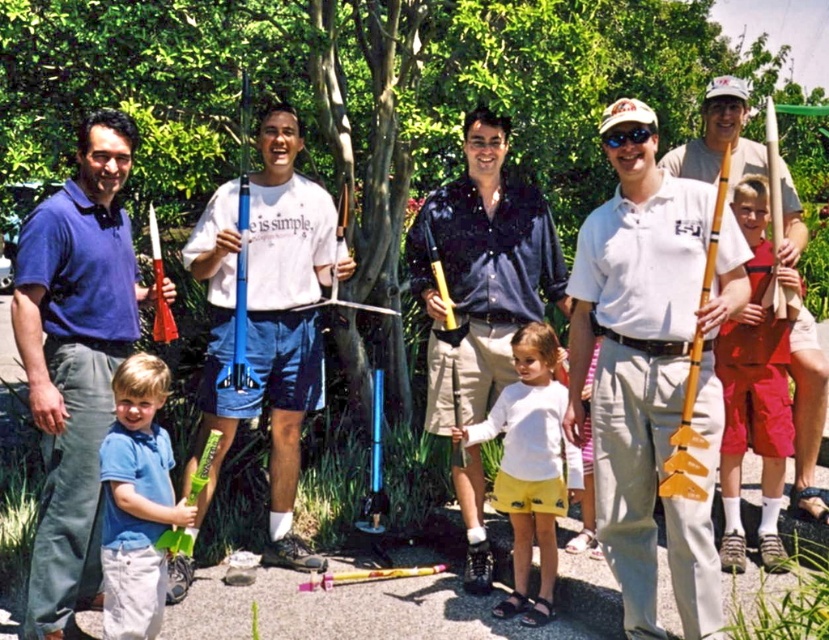
Who is more forward, [187,474] or [468,566]?

Point [468,566] is more forward.

Describe the element at coordinates (267, 317) in the screenshot. I see `white matte rocket at center` at that location.

Describe the element at coordinates (267, 317) in the screenshot. I see `white matte rocket at center` at that location.

You are a GUI agent. You are given a task and a screenshot of the screen. Output one action in this format:
    pyautogui.click(x=<x>, y=<y>)
    Task: Click on the white matte rocket at center
    
    Given the screenshot: What is the action you would take?
    pyautogui.click(x=267, y=317)

Who is positioned more to the right, white matte rocket at center or matte yellow rocket at right?

From the viewer's perspective, matte yellow rocket at right appears more on the right side.

Is white matte rocket at center bigger than matte yellow rocket at right?

Yes, white matte rocket at center is bigger than matte yellow rocket at right.

Between point (209, 200) and point (752, 141), which one is positioned behind?

Positioned behind is point (752, 141).

Locate an element on the screen. white matte rocket at center is located at coordinates (267, 317).

Looking at this image, is matte white polo shirt at center above red cotton shorts at right?

Indeed, matte white polo shirt at center is positioned over red cotton shorts at right.

Which is more to the left, matte white polo shirt at center or red cotton shorts at right?

matte white polo shirt at center is more to the left.

Is point (585, 346) in front of point (731, 554)?

Yes, it is.

At what (x,y) coordinates should I click in order to perform the action: click on matte white polo shirt at center. Please return your answer as a coordinate pair (x, y). The image size is (829, 640). Looking at the image, I should click on [x=651, y=368].